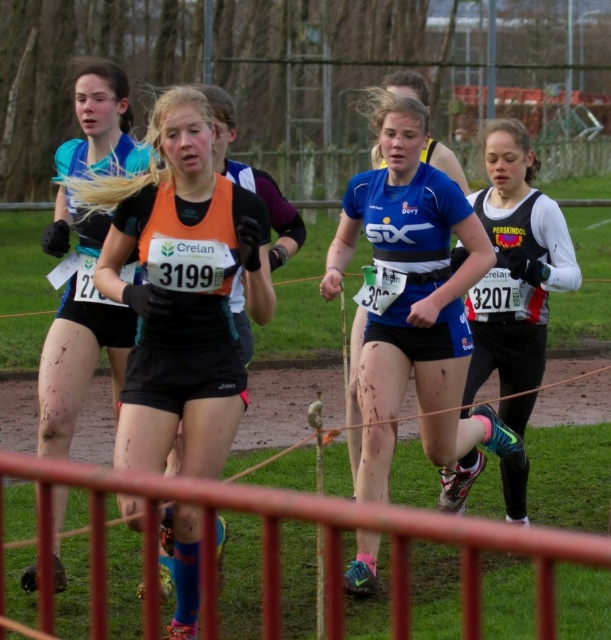
Question: Which point is closer to the camera taking this photo?

Choices:
 (A) (423, 115)
 (B) (514, 221)
 (C) (65, 225)
 (D) (137, 404)

Answer: (D)

Question: Is orange matte vest at center thinner than matte blue top at center?

Choices:
 (A) no
 (B) yes

Answer: (A)

Question: Is orange matte vest at center above black matte running suit at right?

Choices:
 (A) yes
 (B) no

Answer: (B)

Question: Can you confirm if orange matte vest at center is bigger than blue matte jersey at center?

Choices:
 (A) no
 (B) yes

Answer: (A)

Question: Estimate the real-world distances between objects in this image. Which object is farther from the orange matte vest at center?

Choices:
 (A) matte blue top at center
 (B) black matte running suit at right
 (C) blue matte jersey at center

Answer: (B)

Question: Which of these objects is positioned closest to the matte blue top at center?

Choices:
 (A) orange matte vest at center
 (B) black matte running suit at right

Answer: (A)